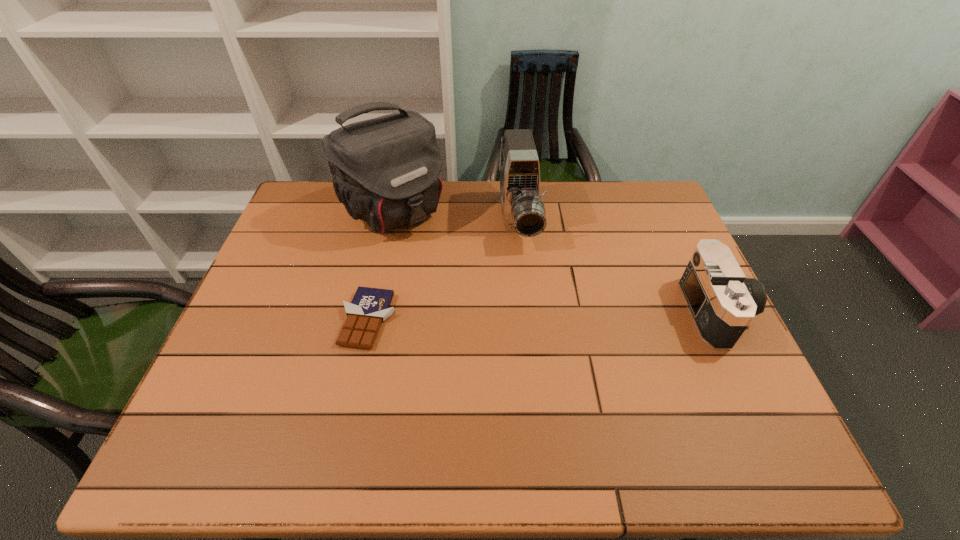
Where is `chocolate bar`? Image resolution: width=960 pixels, height=540 pixels. chocolate bar is located at coordinates (369, 307).

The width and height of the screenshot is (960, 540). I want to click on the second shortest object, so click(x=722, y=302).

What are the coordinates of `the rightmost object` in the screenshot? It's located at (722, 302).

Identify the location of the third object from left to right. Image resolution: width=960 pixels, height=540 pixels. (523, 211).

This screenshot has width=960, height=540. Identify the location of the second tallest object. (523, 211).

The height and width of the screenshot is (540, 960). In order to click on shoulder bag in this screenshot , I will do `click(385, 170)`.

This screenshot has width=960, height=540. In order to click on free point located 0.060m on the front of the shortest object in this screenshot , I will do `click(356, 373)`.

Image resolution: width=960 pixels, height=540 pixels. What are the coordinates of `vacant space located 0.340m at the front of the camcorder, highlighting the lens` in the screenshot? It's located at (538, 349).

Where is `free location located at the front of the camcorder, highlighting the lens`? The width and height of the screenshot is (960, 540). free location located at the front of the camcorder, highlighting the lens is located at coordinates (524, 265).

Identify the location of vacant space located at the front of the camcorder, highlighting the lens. (532, 314).